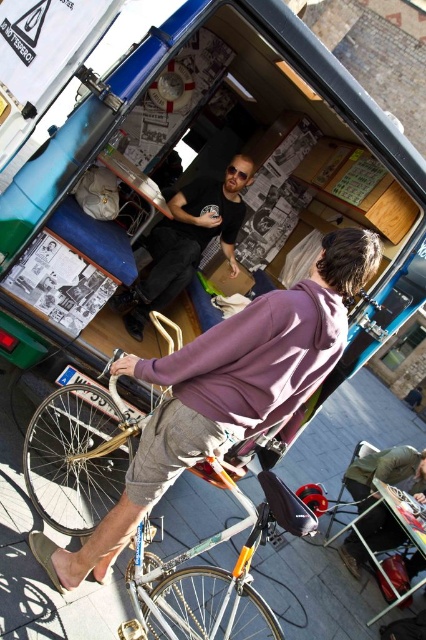
Question: Which object is the closest to the light brown leather jacket at lower right?

Choices:
 (A) black matte t-shirt at center
 (B) silver metallic bicycle at lower left

Answer: (B)

Question: Can you confirm if silver metallic bicycle at lower left is positioned above light brown leather jacket at lower right?

Choices:
 (A) yes
 (B) no

Answer: (A)

Question: Considering the relative positions of black matte t-shirt at center and light brown leather jacket at lower right in the image provided, where is black matte t-shirt at center located with respect to light brown leather jacket at lower right?

Choices:
 (A) right
 (B) left

Answer: (B)

Question: Can you confirm if black matte t-shirt at center is positioned below light brown leather jacket at lower right?

Choices:
 (A) yes
 (B) no

Answer: (B)

Question: Estimate the real-world distances between objects in this image. Which object is farther from the light brown leather jacket at lower right?

Choices:
 (A) black matte t-shirt at center
 (B) silver metallic bicycle at lower left

Answer: (A)

Question: Which point appears farthest from the camera in this image?

Choices:
 (A) (232, 208)
 (B) (94, 477)
 (C) (379, 528)

Answer: (C)